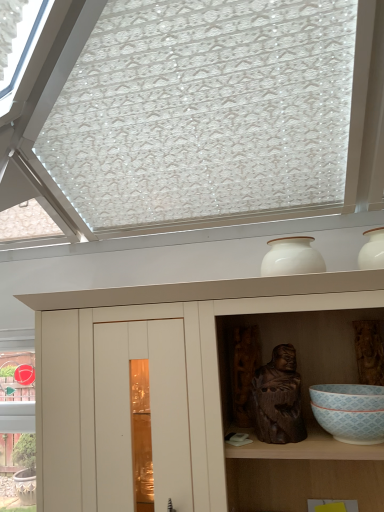
Question: Considering the relative sizes of white matte cupboard at upper center and white glossy vase at upper center in the image provided, is white matte cupboard at upper center taller than white glossy vase at upper center?

Choices:
 (A) yes
 (B) no

Answer: (A)

Question: From the image's perspective, is white matte cupboard at upper center located beneath white glossy vase at upper center?

Choices:
 (A) no
 (B) yes

Answer: (B)

Question: Can you confirm if white matte cupboard at upper center is shorter than white glossy vase at upper center?

Choices:
 (A) no
 (B) yes

Answer: (A)

Question: Does white matte cupboard at upper center have a larger size compared to white glossy vase at upper center?

Choices:
 (A) yes
 (B) no

Answer: (A)

Question: Is there a large distance between white matte cupboard at upper center and white glossy vase at upper center?

Choices:
 (A) yes
 (B) no

Answer: (B)

Question: From the image's perspective, is white matte cupboard at upper center above or below dark brown wood statue at center?

Choices:
 (A) below
 (B) above

Answer: (A)

Question: Considering the positions of white matte cupboard at upper center and dark brown wood statue at center in the image, is white matte cupboard at upper center wider or thinner than dark brown wood statue at center?

Choices:
 (A) wide
 (B) thin

Answer: (A)

Question: Considering the positions of white matte cupboard at upper center and dark brown wood statue at center in the image, is white matte cupboard at upper center taller or shorter than dark brown wood statue at center?

Choices:
 (A) tall
 (B) short

Answer: (A)

Question: Is point (77, 490) positioned closer to the camera than point (258, 379)?

Choices:
 (A) closer
 (B) farther

Answer: (A)

Question: From the image's perspective, is white glossy vase at upper center above or below dark brown wood statue at center?

Choices:
 (A) below
 (B) above

Answer: (B)

Question: From their relative heights in the image, would you say white glossy vase at upper center is taller or shorter than dark brown wood statue at center?

Choices:
 (A) short
 (B) tall

Answer: (A)

Question: In the image, is white glossy vase at upper center on the left side or the right side of dark brown wood statue at center?

Choices:
 (A) right
 (B) left

Answer: (A)

Question: Does point (291, 242) appear closer or farther from the camera than point (269, 387)?

Choices:
 (A) farther
 (B) closer

Answer: (A)

Question: Choose the correct answer: Is white glossy vase at upper center inside white glossy bowl at lower right or outside it?

Choices:
 (A) outside
 (B) inside

Answer: (A)

Question: From the image's perspective, relative to white glossy bowl at lower right, is white glossy vase at upper center above or below?

Choices:
 (A) above
 (B) below

Answer: (A)